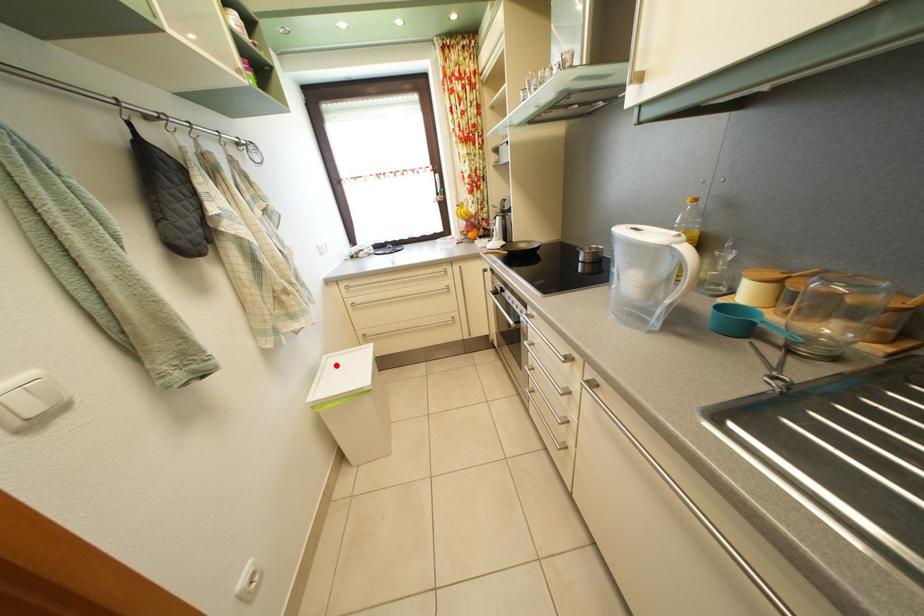
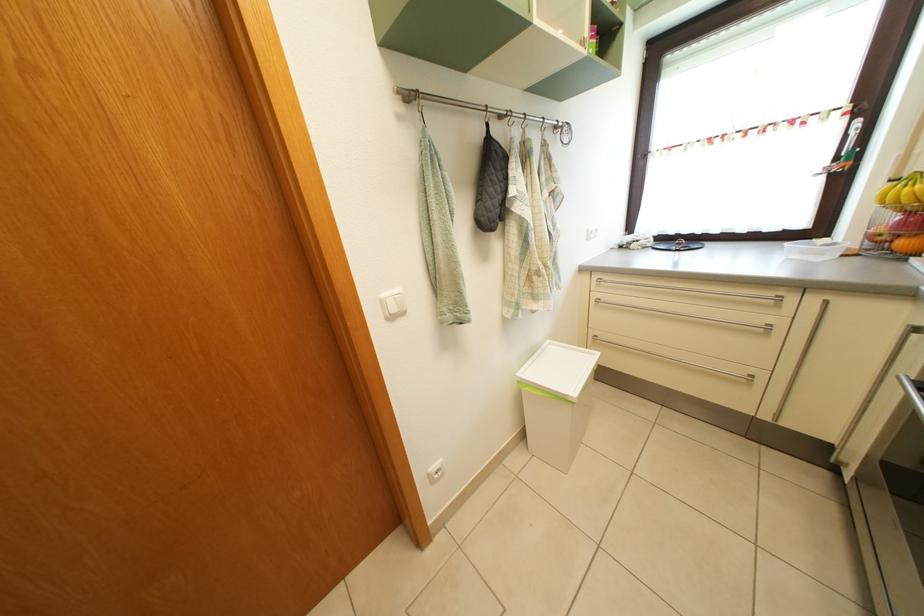
Where in the second image is the point corresponding to the highlighted location from the first image?

(557, 352)